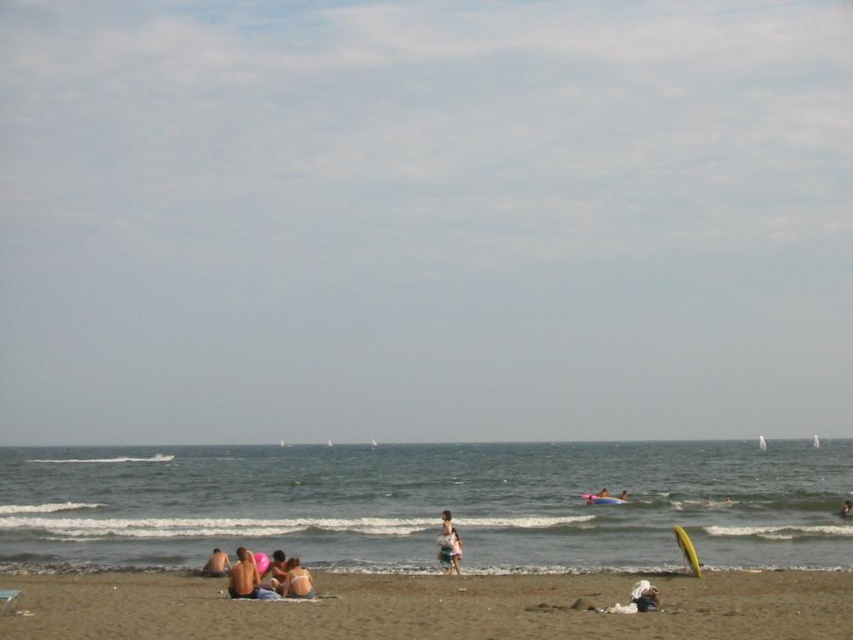
Question: In this image, where is clear blue water at lower center located relative to beige fabric bikini at center?

Choices:
 (A) left
 (B) right

Answer: (B)

Question: Is matte pink beach ball at lower center further to the viewer compared to beige sand at lower left?

Choices:
 (A) yes
 (B) no

Answer: (B)

Question: Which point is closer to the camera?

Choices:
 (A) (219, 573)
 (B) (88, 584)
 (C) (288, 573)
 (D) (442, 516)

Answer: (C)

Question: Which point is farther to the camera?

Choices:
 (A) (241, 586)
 (B) (299, 589)
 (C) (212, 381)
 (D) (209, 570)

Answer: (C)

Question: Does clear blue water at lower center come in front of matte pink beach ball at lower center?

Choices:
 (A) yes
 (B) no

Answer: (B)

Question: Which point is farther to the camera?

Choices:
 (A) (216, 572)
 (B) (94, 556)
 (C) (271, 596)

Answer: (B)